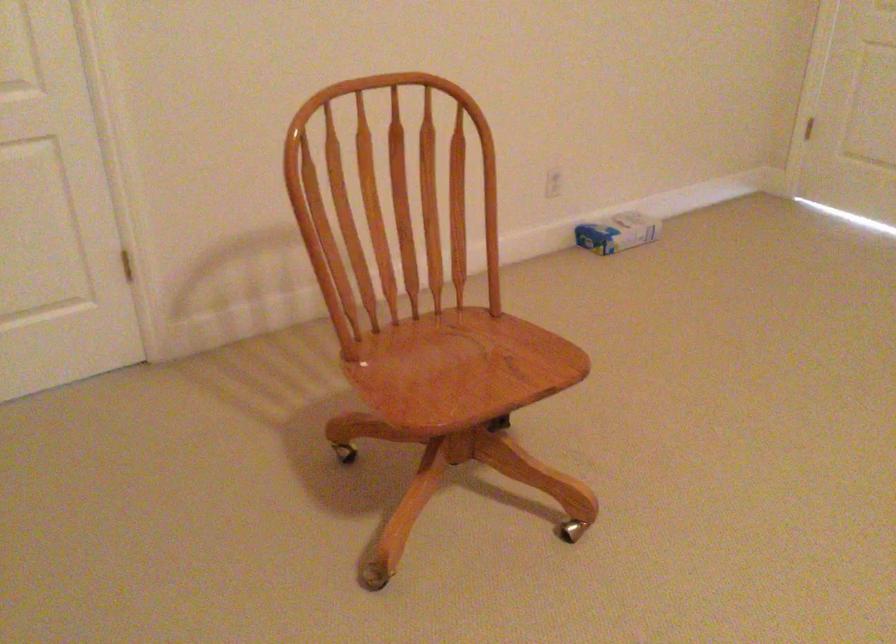
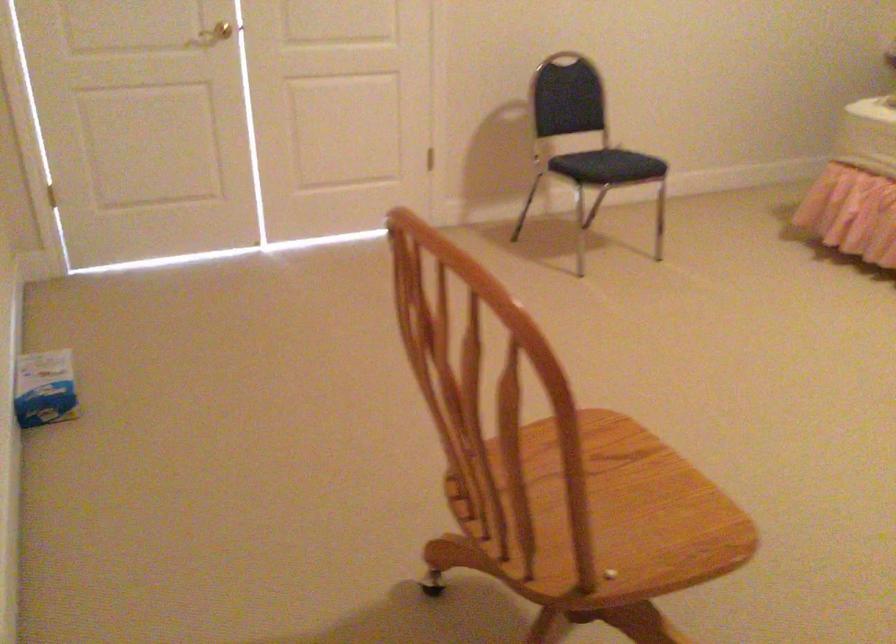
In the second image, find the point that corresponds to point 446,391 in the first image.

(613, 509)